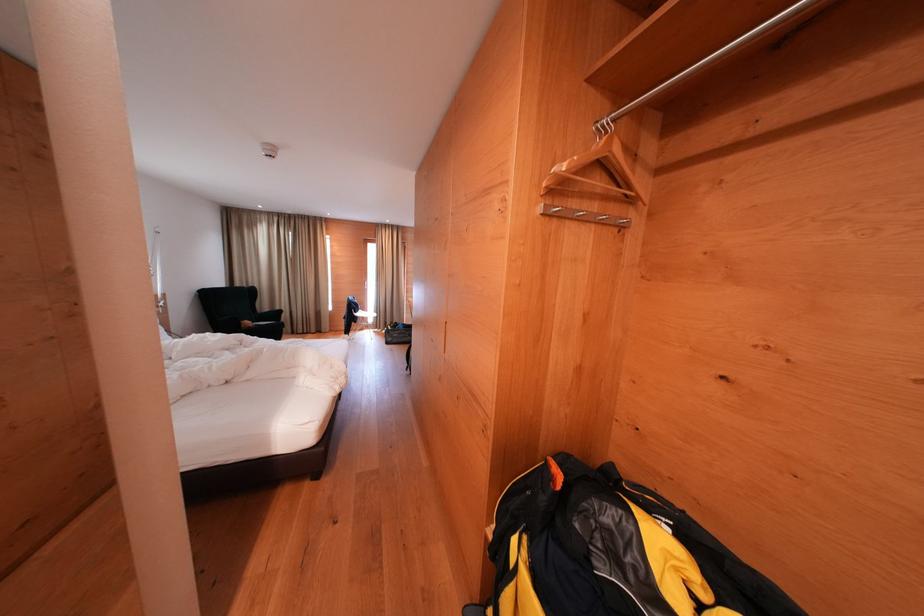
You are a GUI agent. You are given a task and a screenshot of the screen. Output one action in this format:
    pyautogui.click(x=<x>, y=<y>)
    Task: Click on the white chair sitting surface
    This screenshot has width=924, height=616.
    Given the screenshot: What is the action you would take?
    pyautogui.click(x=366, y=315)